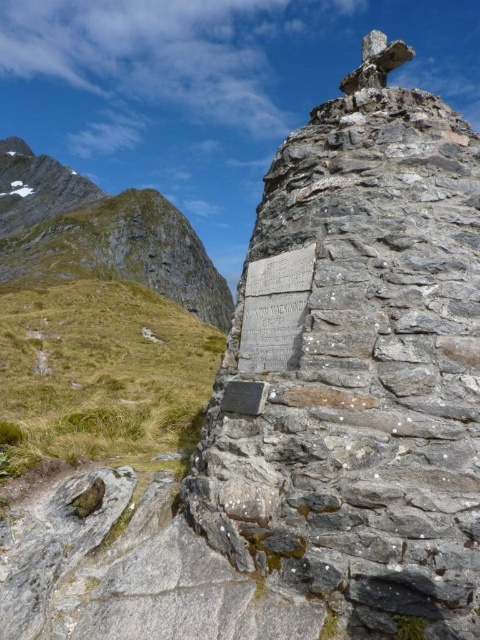
Question: Which point is farther from the camera taking this photo?

Choices:
 (A) (104, 196)
 (B) (294, 356)

Answer: (A)

Question: Is gray stone monument at center positioned behind rugged stone mountain at upper left?

Choices:
 (A) no
 (B) yes

Answer: (A)

Question: Can you confirm if rugged stone mountain at upper left is thinner than white stone plaque at center?

Choices:
 (A) no
 (B) yes

Answer: (A)

Question: Which point appears closest to the camera in this image?

Choices:
 (A) (251, 323)
 (B) (27, 349)
 (C) (8, 150)
 (D) (418, 328)

Answer: (D)

Question: Can you confirm if green grass at left is bigger than rugged stone mountain at upper left?

Choices:
 (A) yes
 (B) no

Answer: (B)

Question: Which object is the farthest from the rugged stone mountain at upper left?

Choices:
 (A) gray stone monument at center
 (B) white stone plaque at center

Answer: (A)